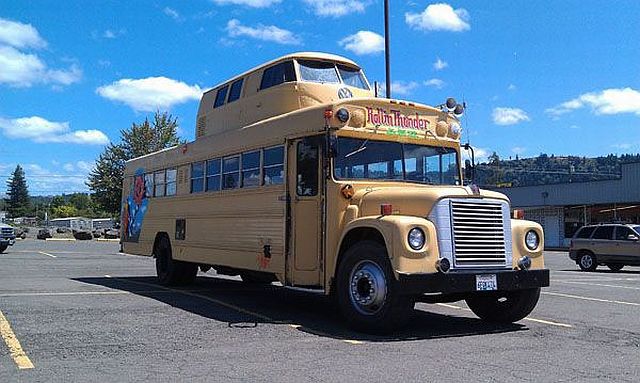
The width and height of the screenshot is (640, 383). Identify the location of light. (13, 232), (0, 231), (415, 238), (532, 240), (569, 245), (342, 116), (454, 132), (349, 190), (385, 210), (518, 215).